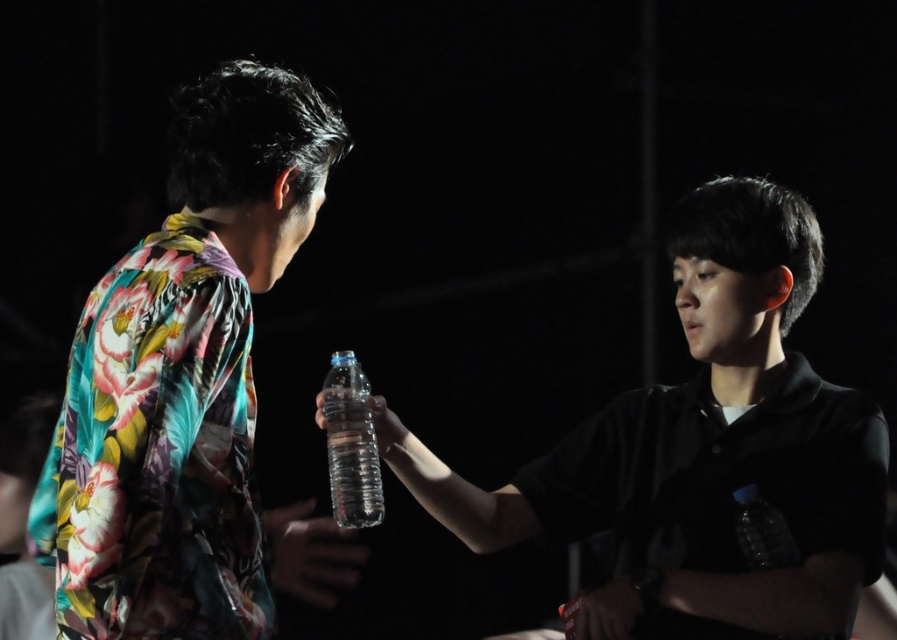
Is transparent plastic water bottle at center further to camera compared to transparent plastic bottle at center?

No, it is in front of transparent plastic bottle at center.

Who is lower down, transparent plastic water bottle at center or transparent plastic bottle at center?

transparent plastic bottle at center is below.

Is point (537, 516) farther from viewer compared to point (375, 417)?

Yes, point (537, 516) is farther from viewer.

Find the location of a particular element. The image size is (897, 640). transparent plastic water bottle at center is located at coordinates (707, 451).

This screenshot has width=897, height=640. Identify the location of clear plastic bottle at center. (351, 444).

Is clear plastic bottle at center thinner than transparent plastic bottle at center?

Yes, clear plastic bottle at center is thinner than transparent plastic bottle at center.

Identify the location of clear plastic bottle at center. (351, 444).

Where is `clear plastic bottle at center`? The width and height of the screenshot is (897, 640). clear plastic bottle at center is located at coordinates (351, 444).

Is floral-patterned shirt at left wider than transparent plastic bottle at center?

Yes, floral-patterned shirt at left is wider than transparent plastic bottle at center.

Who is more distant from viewer, (170, 589) or (382, 413)?

The point (382, 413) is more distant.

Where is `floral-patterned shirt at left`? The width and height of the screenshot is (897, 640). floral-patterned shirt at left is located at coordinates (183, 376).